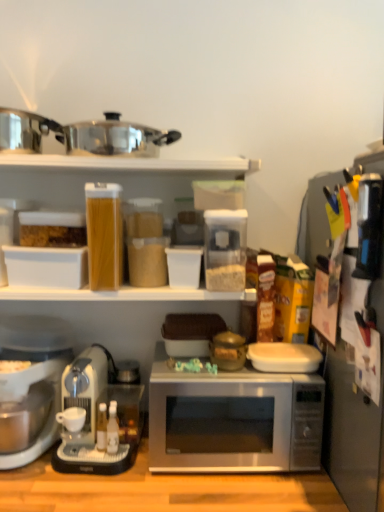
The height and width of the screenshot is (512, 384). What do you see at coordinates (114, 137) in the screenshot?
I see `shiny metallic pot at upper center` at bounding box center [114, 137].

This screenshot has height=512, width=384. I want to click on white plastic coffee maker at lower left, which is the 1th coffee maker from left to right, so click(x=28, y=395).

Locate an element on the screen. The width and height of the screenshot is (384, 512). silver metallic microwave at center is located at coordinates (234, 420).

In order to face matte brown pot at center, placed as the first appliance when sorted from left to right, should I rotate leftwards or rightwards?

Rotate your view right by about 4.587°.

Image resolution: width=384 pixels, height=512 pixels. In order to click on white matte coffee cup at lower left in this screenshot , I will do `click(72, 419)`.

Consider the image. What's the angular difference between white plastic coffee maker at lower left, the second coffee maker from the right, and sleek silver coffee maker at lower left, acting as the first coffee maker starting from the right,'s facing directions?

There is a 3.34-degree angle between the facing directions of white plastic coffee maker at lower left, the second coffee maker from the right, and sleek silver coffee maker at lower left, acting as the first coffee maker starting from the right.

Find the location of `coffee maker below the white plastic coffee maker at lower left, which is the 1th coffee maker from left to right (from the image's perspective)`. coffee maker below the white plastic coffee maker at lower left, which is the 1th coffee maker from left to right (from the image's perspective) is located at coordinates (98, 416).

Can you confirm if white plastic coffee maker at lower left, the second coffee maker from the right, is bigger than sleek silver coffee maker at lower left, the second coffee maker positioned from the left?

Indeed, white plastic coffee maker at lower left, the second coffee maker from the right, has a larger size compared to sleek silver coffee maker at lower left, the second coffee maker positioned from the left.

Considering the relative sizes of white plastic coffee maker at lower left, the second coffee maker from the right, and sleek silver coffee maker at lower left, the second coffee maker positioned from the left, in the image provided, is white plastic coffee maker at lower left, the second coffee maker from the right, wider than sleek silver coffee maker at lower left, the second coffee maker positioned from the left,?

Correct, the width of white plastic coffee maker at lower left, the second coffee maker from the right, exceeds that of sleek silver coffee maker at lower left, the second coffee maker positioned from the left.

Does point (326, 233) appear closer or farther from the camera than point (169, 139)?

Point (326, 233) is closer to the camera than point (169, 139).

Is black plastic knife block at right, marked as the 3th appliance in a left-to-right arrangement, aimed at shiny metallic pot at upper center?

Yes, black plastic knife block at right, marked as the 3th appliance in a left-to-right arrangement, is oriented towards shiny metallic pot at upper center.

In the image, is black plastic knife block at right, marked as the 3th appliance in a left-to-right arrangement, on the left side or the right side of shiny metallic pot at upper center?

Based on their positions, black plastic knife block at right, marked as the 3th appliance in a left-to-right arrangement, is located to the right of shiny metallic pot at upper center.

From a real-world perspective, is black plastic knife block at right, marked as the first appliance in a right-to-left arrangement, over shiny metallic pot at upper center?

No, from a real-world perspective, black plastic knife block at right, marked as the first appliance in a right-to-left arrangement, is not over shiny metallic pot at upper center

Can you see sleek silver coffee maker at lower left, the second coffee maker positioned from the left, touching black plastic knife block at right, marked as the first appliance in a right-to-left arrangement?

There is a gap between sleek silver coffee maker at lower left, the second coffee maker positioned from the left, and black plastic knife block at right, marked as the first appliance in a right-to-left arrangement.

Would you say sleek silver coffee maker at lower left, the second coffee maker positioned from the left, contains black plastic knife block at right, marked as the 3th appliance in a left-to-right arrangement?

That's incorrect, black plastic knife block at right, marked as the 3th appliance in a left-to-right arrangement, is not inside sleek silver coffee maker at lower left, the second coffee maker positioned from the left.

From a real-world perspective, does sleek silver coffee maker at lower left, acting as the first coffee maker starting from the right, stand above black plastic knife block at right, marked as the 3th appliance in a left-to-right arrangement?

No, from a real-world perspective, sleek silver coffee maker at lower left, acting as the first coffee maker starting from the right, is not above black plastic knife block at right, marked as the 3th appliance in a left-to-right arrangement.

From the image's perspective, which is above, sleek silver coffee maker at lower left, acting as the first coffee maker starting from the right, or black plastic knife block at right, marked as the 3th appliance in a left-to-right arrangement?

From the image's view, black plastic knife block at right, marked as the 3th appliance in a left-to-right arrangement, is above.

Looking at this image, looking at the image, does shiny metallic pot at upper center seem bigger or smaller compared to black plastic knife block at right, the second appliance positioned from the left?

Clearly, shiny metallic pot at upper center is larger in size than black plastic knife block at right, the second appliance positioned from the left.

From the image's perspective, which one is positioned higher, shiny metallic pot at upper center or black plastic knife block at right, the second appliance positioned from the left?

shiny metallic pot at upper center is shown above in the image.

How many degrees apart are the facing directions of shiny metallic pot at upper center and black plastic knife block at right, marked as the 2th appliance in a right-to-left arrangement?

91.2 degrees.

Can we say sleek silver coffee maker at lower left, the second coffee maker positioned from the left, lies outside black plastic knife block at right, marked as the 2th appliance in a right-to-left arrangement?

That's correct, sleek silver coffee maker at lower left, the second coffee maker positioned from the left, is outside of black plastic knife block at right, marked as the 2th appliance in a right-to-left arrangement.

From a real-world perspective, between sleek silver coffee maker at lower left, acting as the first coffee maker starting from the right, and black plastic knife block at right, the second appliance positioned from the left, who is vertically lower?

sleek silver coffee maker at lower left, acting as the first coffee maker starting from the right, is physically lower.

How many degrees apart are the facing directions of sleek silver coffee maker at lower left, the second coffee maker positioned from the left, and black plastic knife block at right, the second appliance positioned from the left?

They differ by 86.5 degrees in their facing directions.

Is sleek silver coffee maker at lower left, the second coffee maker positioned from the left, far away from black plastic knife block at right, marked as the 2th appliance in a right-to-left arrangement?

No, there isn't a large distance between sleek silver coffee maker at lower left, the second coffee maker positioned from the left, and black plastic knife block at right, marked as the 2th appliance in a right-to-left arrangement.

Is matte brown pot at center, which is counted as the 3th appliance, starting from the right, not within black plastic knife block at right, marked as the 3th appliance in a left-to-right arrangement?

matte brown pot at center, which is counted as the 3th appliance, starting from the right, is positioned outside black plastic knife block at right, marked as the 3th appliance in a left-to-right arrangement.

Where is `appliance below the black plastic knife block at right, marked as the 3th appliance in a left-to-right arrangement (from the image's perspective)`? appliance below the black plastic knife block at right, marked as the 3th appliance in a left-to-right arrangement (from the image's perspective) is located at coordinates (228, 350).

Are matte brown pot at center, placed as the first appliance when sorted from left to right, and black plastic knife block at right, marked as the 3th appliance in a left-to-right arrangement, far apart?

No, there isn't a large distance between matte brown pot at center, placed as the first appliance when sorted from left to right, and black plastic knife block at right, marked as the 3th appliance in a left-to-right arrangement.

From the image's perspective, is matte brown pot at center, placed as the first appliance when sorted from left to right, located beneath black plastic knife block at right, marked as the first appliance in a right-to-left arrangement?

Yes.

Does matte brown pot at center, placed as the first appliance when sorted from left to right, have a larger size compared to sleek silver coffee maker at lower left, the second coffee maker positioned from the left?

Actually, matte brown pot at center, placed as the first appliance when sorted from left to right, might be smaller than sleek silver coffee maker at lower left, the second coffee maker positioned from the left.

Is matte brown pot at center, which is counted as the 3th appliance, starting from the right, oriented away from sleek silver coffee maker at lower left, the second coffee maker positioned from the left?

That's not correct — matte brown pot at center, which is counted as the 3th appliance, starting from the right, is not looking away from sleek silver coffee maker at lower left, the second coffee maker positioned from the left.

Considering the sizes of matte brown pot at center, placed as the first appliance when sorted from left to right, and sleek silver coffee maker at lower left, acting as the first coffee maker starting from the right, in the image, is matte brown pot at center, placed as the first appliance when sorted from left to right, taller or shorter than sleek silver coffee maker at lower left, acting as the first coffee maker starting from the right,?

Considering their sizes, matte brown pot at center, placed as the first appliance when sorted from left to right, has less height than sleek silver coffee maker at lower left, acting as the first coffee maker starting from the right.

Where is `coffee maker located below the white plastic coffee maker at lower left, the second coffee maker from the right (from the image's perspective)`? coffee maker located below the white plastic coffee maker at lower left, the second coffee maker from the right (from the image's perspective) is located at coordinates (98, 416).

Starting from the shiny metallic pot at upper center, which appliance is the 2nd one in front? Please provide its 2D coordinates.

[(355, 419)]

Looking at the image, which one is located further to shiny metallic pot at upper center, silver metallic microwave at center or sleek silver coffee maker at lower left, acting as the first coffee maker starting from the right?

The object further to shiny metallic pot at upper center is silver metallic microwave at center.

When comparing their distances from black plastic knife block at right, marked as the 2th appliance in a right-to-left arrangement, does silver metallic microwave at center or black plastic knife block at right, marked as the 3th appliance in a left-to-right arrangement, seem closer?

black plastic knife block at right, marked as the 3th appliance in a left-to-right arrangement, is closer to black plastic knife block at right, marked as the 2th appliance in a right-to-left arrangement.

Based on their spatial positions, is black plastic knife block at right, marked as the 3th appliance in a left-to-right arrangement, or white plastic coffee maker at lower left, which is the 1th coffee maker from left to right, closer to white matte coffee cup at lower left?

Based on the image, white plastic coffee maker at lower left, which is the 1th coffee maker from left to right, appears to be nearer to white matte coffee cup at lower left.

Considering their positions, is black plastic knife block at right, marked as the 3th appliance in a left-to-right arrangement, positioned further to silver metallic microwave at center than shiny metallic pot at upper center?

The object further to silver metallic microwave at center is shiny metallic pot at upper center.

Looking at the image, which one is located further to white plastic coffee maker at lower left, which is the 1th coffee maker from left to right, black plastic knife block at right, marked as the 3th appliance in a left-to-right arrangement, or sleek silver coffee maker at lower left, the second coffee maker positioned from the left?

The object further to white plastic coffee maker at lower left, which is the 1th coffee maker from left to right, is black plastic knife block at right, marked as the 3th appliance in a left-to-right arrangement.

Considering their positions, is sleek silver coffee maker at lower left, the second coffee maker positioned from the left, positioned closer to white plastic coffee maker at lower left, which is the 1th coffee maker from left to right, than black plastic knife block at right, marked as the first appliance in a right-to-left arrangement?

Based on the image, sleek silver coffee maker at lower left, the second coffee maker positioned from the left, appears to be nearer to white plastic coffee maker at lower left, which is the 1th coffee maker from left to right.

Estimate the real-world distances between objects in this image. Which object is closer to sleek silver coffee maker at lower left, acting as the first coffee maker starting from the right, white plastic coffee maker at lower left, the second coffee maker from the right, or white matte coffee cup at lower left?

Among the two, white matte coffee cup at lower left is located nearer to sleek silver coffee maker at lower left, acting as the first coffee maker starting from the right.

Looking at the image, which one is located closer to sleek silver coffee maker at lower left, acting as the first coffee maker starting from the right, silver metallic microwave at center or black plastic knife block at right, the second appliance positioned from the left?

silver metallic microwave at center lies closer to sleek silver coffee maker at lower left, acting as the first coffee maker starting from the right, than the other object.

This screenshot has width=384, height=512. Identify the location of microwave oven between white matte coffee cup at lower left and black plastic knife block at right, marked as the first appliance in a right-to-left arrangement, from left to right. (234, 420).

Identify the location of appliance between white plastic coffee maker at lower left, the second coffee maker from the right, and black plastic knife block at right, the second appliance positioned from the left, in the horizontal direction. The image size is (384, 512). (228, 350).

Locate an element on the screen. appliance between black plastic knife block at right, marked as the first appliance in a right-to-left arrangement, and matte brown pot at center, which is counted as the 3th appliance, starting from the right, in the front-back direction is located at coordinates (369, 226).

Locate an element on the screen. coffee maker between white plastic coffee maker at lower left, the second coffee maker from the right, and silver metallic microwave at center is located at coordinates (98, 416).